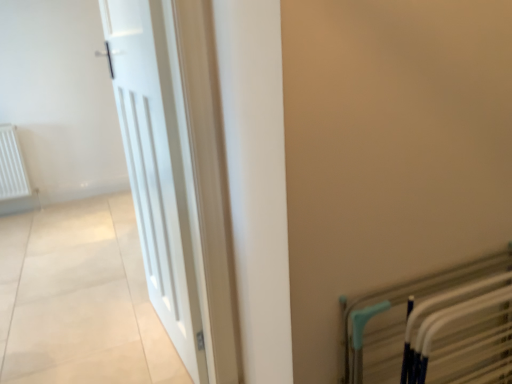
The width and height of the screenshot is (512, 384). What are the coordinates of `vacant space that is to the left of white wooden door at left` in the screenshot? It's located at (96, 339).